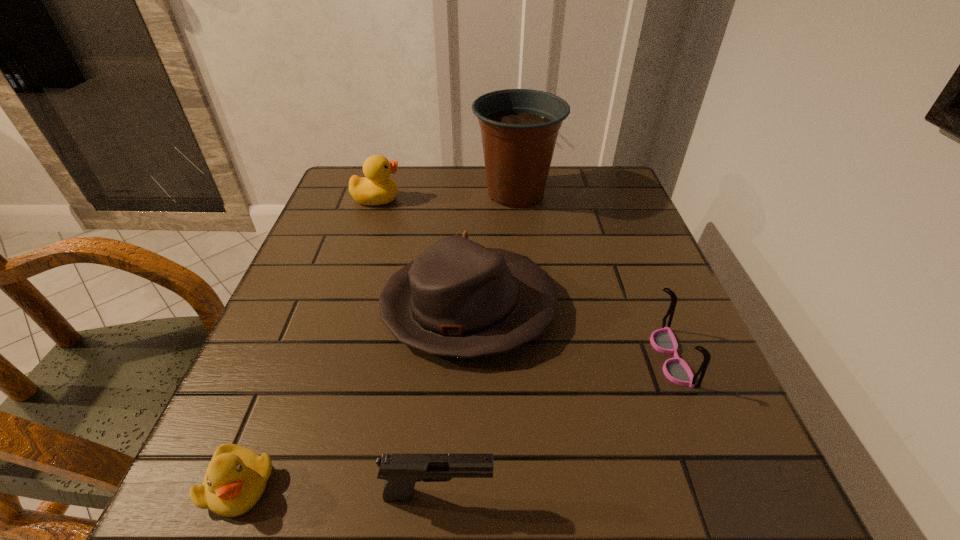
Locate an element on the screen. This screenshot has height=540, width=960. vacant space that satisfies the following two spatial constraints: 1. on the decorative side of the hat; 2. on the front-facing side of the duckling is located at coordinates (464, 485).